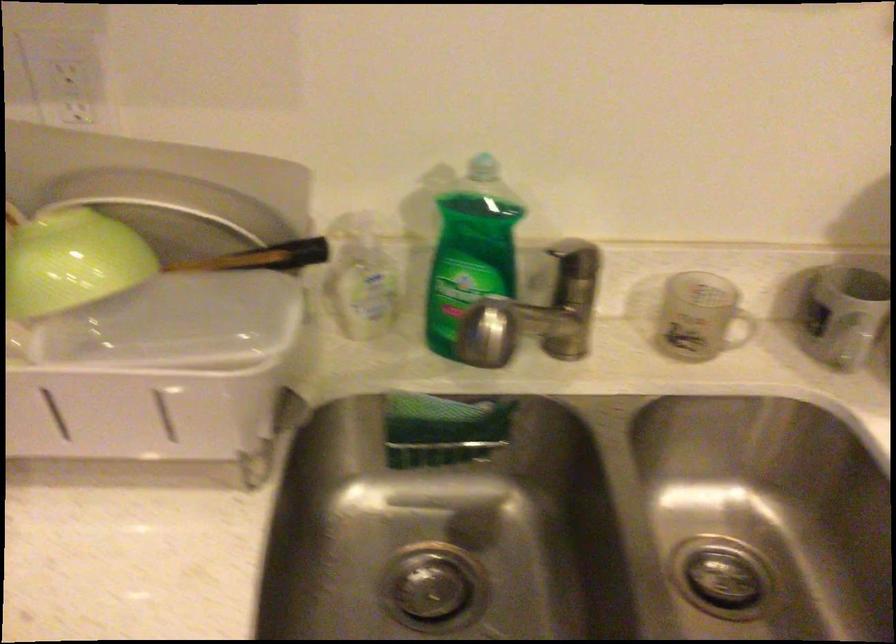
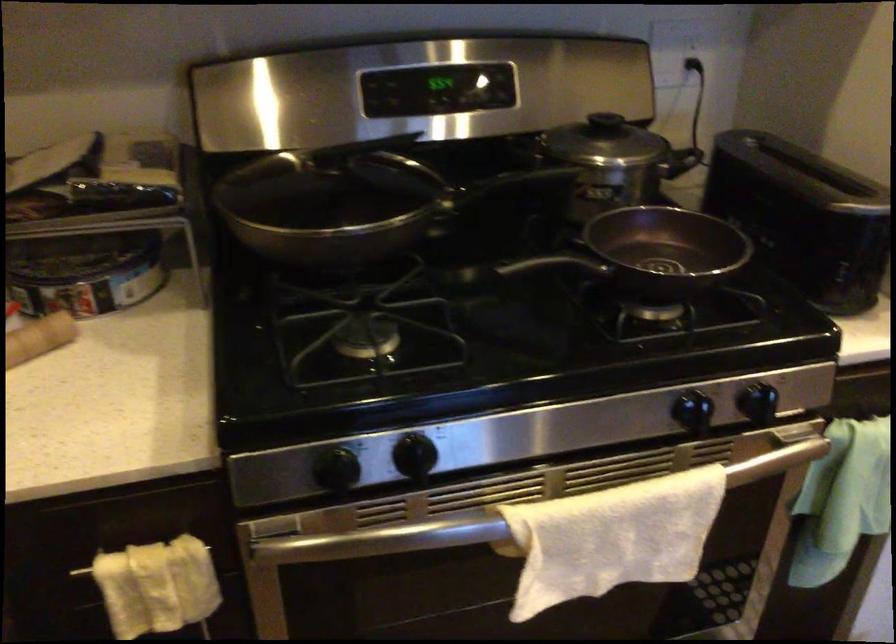
How did the camera likely rotate?

The camera's rotation is toward right-down.